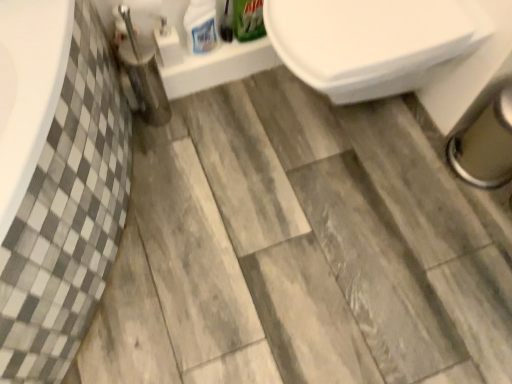
Where is `vacant space in front of white glossy toilet at upper right`? vacant space in front of white glossy toilet at upper right is located at coordinates (346, 223).